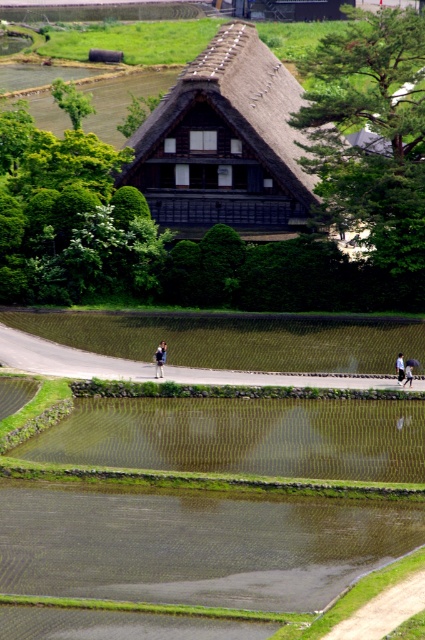
You are a visitor to this rural area and need to set up a small tent. You have two options for placement based on the objects in the scene. The first option is next to the thatched wood hut at center, and the second is near the light blue fabric at lower right. Considering the widths of these objects, which location would allow for more space around your tent?

The thatched wood hut at center is wider than the light blue fabric at lower right, so placing the tent next to the thatched wood hut at center would provide more space around it.

You are standing at the point closer to the camera in the scene. There are two points marked in the image, point A at coordinates point A is point [397,365] and point B is point [408,380]. Which point are you currently standing at?

You are standing at point A at coordinates point A is point [397,365] because it is further to the camera than point B at point [408,380].

You are a visitor standing on the pathway in the scene. You see the light blue fabric at lower right and the blue fabric umbrella at lower center. Which object is taller?

The light blue fabric at lower right has a greater height compared to the blue fabric umbrella at lower center, so the light blue fabric at lower right is taller.